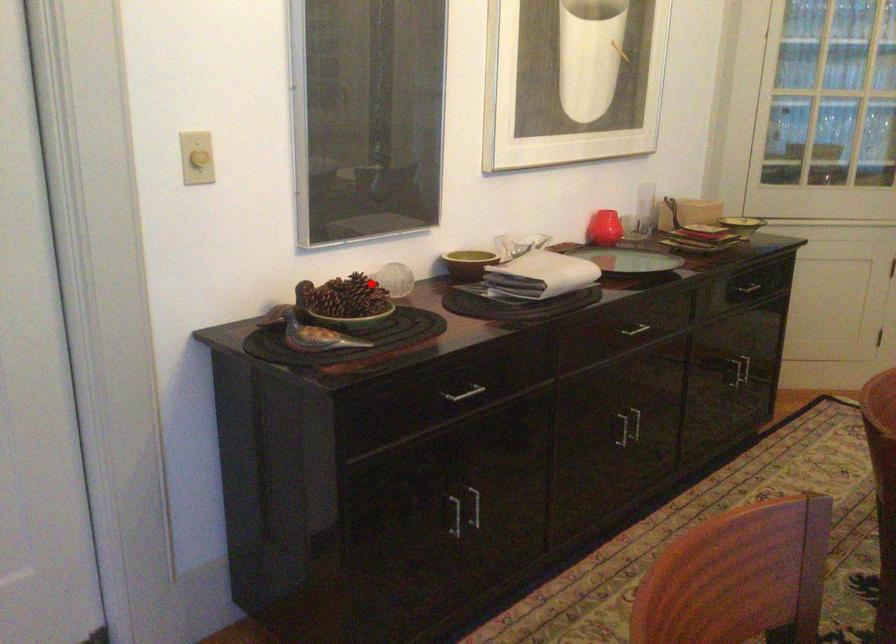
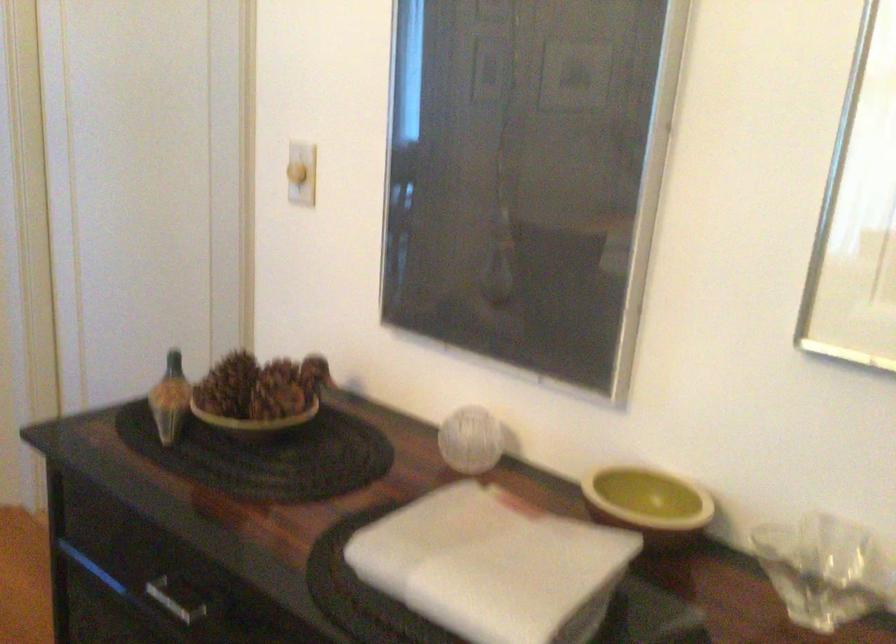
Question: I am providing you with two images of the same scene from different viewpoints. A red point is shown in image1. For the corresponding object point in image2, is it positioned nearer or farther from the camera?

Choices:
 (A) Nearer
 (B) Farther

Answer: (A)